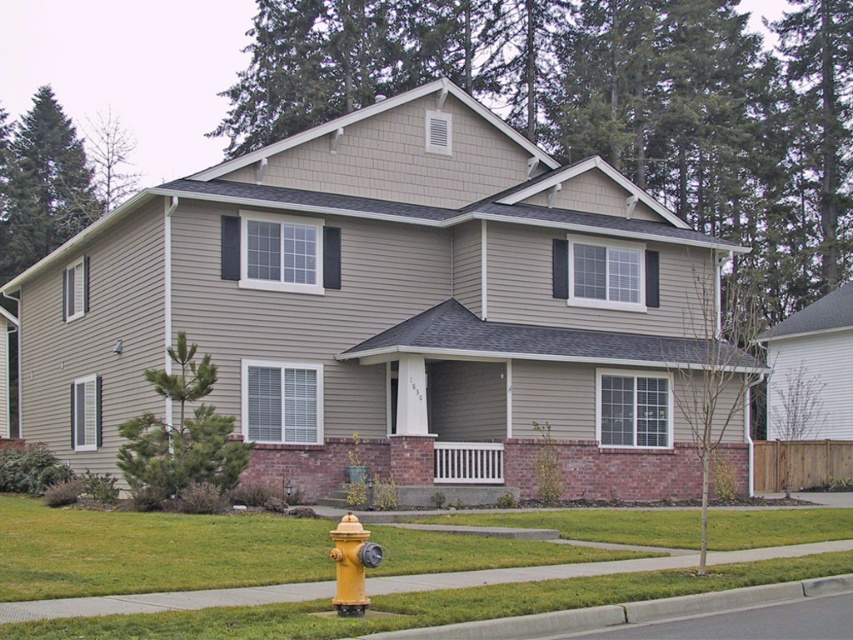
You are standing in front of the house and notice two trees. The first is the green textured tree at lower left and the second is the green leafy tree at upper left. Which tree is positioned more to the left side of the house?

The green leafy tree at upper left is positioned more to the left side of the house because the green textured tree at lower left is to the right of it.

You are standing in front of the house and want to plant a new tree between the green leafy tree at center and the green leafy tree at upper left. Based on their positions, where should you place the new tree?

The green leafy tree at center is located below the green leafy tree at upper left, so you should plant the new tree between them in the space between the lower and upper positioned trees.